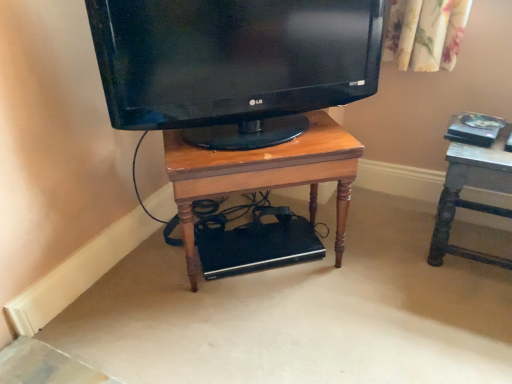
Question: Does matte black tv at center have a greater height compared to wooden table at right?

Choices:
 (A) no
 (B) yes

Answer: (A)

Question: Is matte black tv at center in contact with wooden table at right?

Choices:
 (A) no
 (B) yes

Answer: (A)

Question: From the image's perspective, is matte black tv at center located above wooden table at right?

Choices:
 (A) no
 (B) yes

Answer: (B)

Question: Is matte black tv at center turned away from wooden table at right?

Choices:
 (A) no
 (B) yes

Answer: (A)

Question: Can we say matte black tv at center lies outside wooden table at right?

Choices:
 (A) yes
 (B) no

Answer: (A)

Question: From a real-world perspective, is matte black tv at center over wooden table at right?

Choices:
 (A) no
 (B) yes

Answer: (B)

Question: From the image's perspective, would you say wooden table at right is positioned over matte black tv at center?

Choices:
 (A) yes
 (B) no

Answer: (B)

Question: Does wooden table at right have a greater width compared to matte black tv at center?

Choices:
 (A) no
 (B) yes

Answer: (B)

Question: Is wooden table at right beside matte black tv at center?

Choices:
 (A) no
 (B) yes

Answer: (A)

Question: Considering the relative sizes of wooden table at right and matte black tv at center in the image provided, is wooden table at right smaller than matte black tv at center?

Choices:
 (A) no
 (B) yes

Answer: (B)

Question: Is wooden table at right in front of matte black tv at center?

Choices:
 (A) no
 (B) yes

Answer: (A)

Question: Can you confirm if wooden table at right is shorter than matte black tv at center?

Choices:
 (A) yes
 (B) no

Answer: (B)

Question: Considering the relative sizes of wooden desk at center and matte black tv at center in the image provided, is wooden desk at center thinner than matte black tv at center?

Choices:
 (A) yes
 (B) no

Answer: (B)